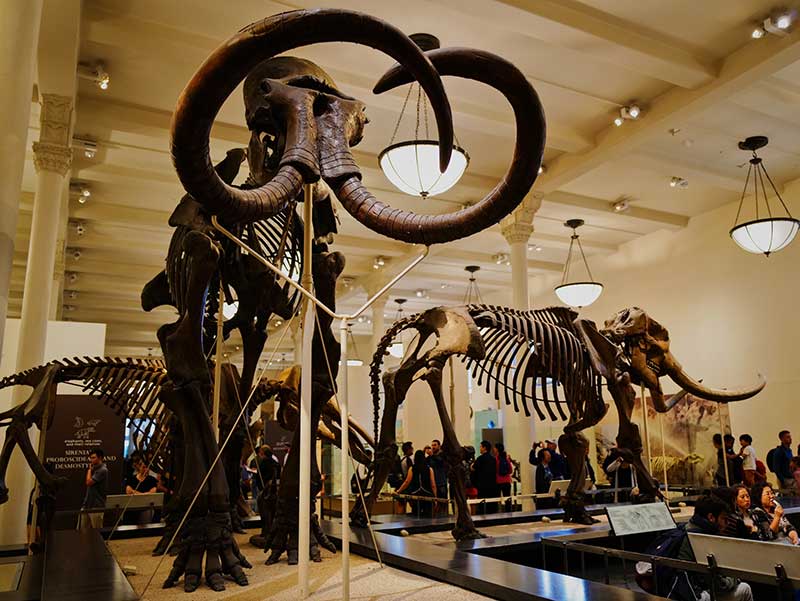
I want to click on support beams, so point(46,239), point(518,279), point(378,321).